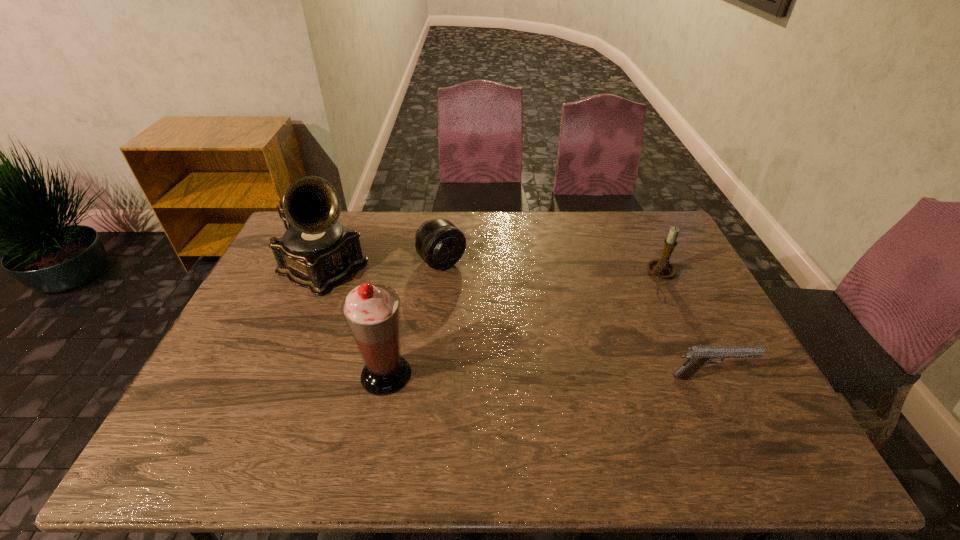
Find the location of `free spot between the pistol and the smoothie`. free spot between the pistol and the smoothie is located at coordinates (547, 376).

You are a GUI agent. You are given a task and a screenshot of the screen. Output one action in this format:
    pyautogui.click(x=<x>, y=<y>)
    Task: Click on the vacant space in between the candle holder and the smoothie
    
    Given the screenshot: What is the action you would take?
    pyautogui.click(x=523, y=323)

Identify the location of free space between the candle holder and the shortest object. The image size is (960, 540). (684, 325).

Locate an element on the screen. unoccupied area between the shortest object and the candle holder is located at coordinates (684, 325).

At what (x,y) coordinates should I click in order to perform the action: click on empty space between the second tallest object and the fourth tallest object. Please return your answer as a coordinate pair (x, y). Looking at the image, I should click on (414, 318).

Identify the location of empty space between the telephoto lens and the fourth shortest object. This screenshot has height=540, width=960. (414, 318).

At what (x,y) coordinates should I click in order to perform the action: click on free space between the tallest object and the telephoto lens. Please return your answer as a coordinate pair (x, y). Image resolution: width=960 pixels, height=540 pixels. Looking at the image, I should click on (382, 265).

Identify the location of free spot between the second shortest object and the tallest object. (382, 265).

I want to click on free spot between the smoothie and the shortest object, so click(547, 376).

Point out which object is positioned as the second nearest to the pistol. Please provide its 2D coordinates. Your answer should be formatted as a tuple, i.e. [(x, y)], where the tuple contains the x and y coordinates of a point satisfying the conditions above.

[(440, 244)]